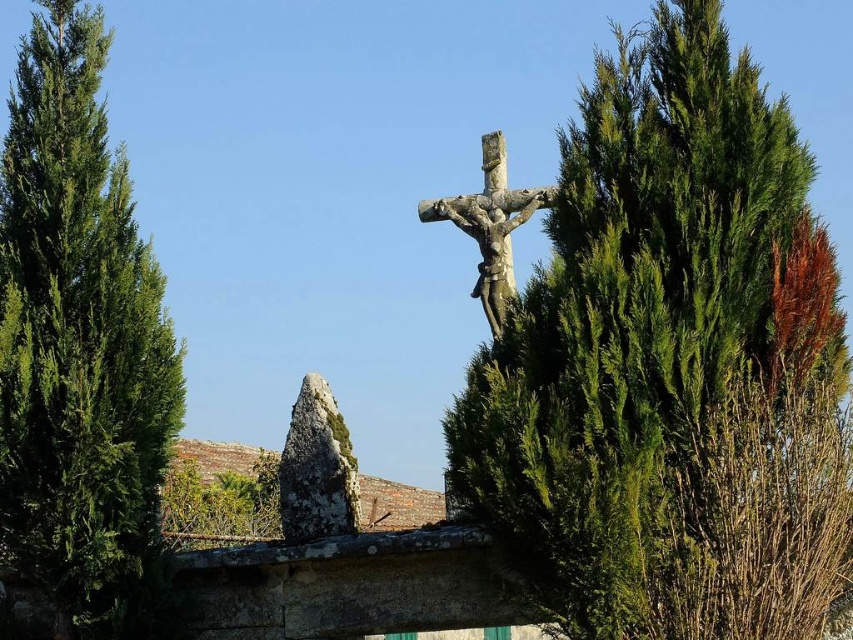
You are a landscape architect designing a garden and want to place the rough gray stone at center and the stone statue at center in a way that maintains visual balance. Given their sizes, which object should be placed farther from the focal point to achieve this balance?

The rough gray stone at center is smaller than the stone statue at center. To achieve visual balance, the smaller rough gray stone at center should be placed closer to the focal point, while the larger stone statue at center should be positioned farther away. This way, the size and distance compensate each other for balance.

You are standing in front of the stone statue at center and want to take a photo of it. There is a green textured tree at upper right in the background. Will the tree block your view of the statue?

The green textured tree at upper right is closer to the viewer than the stone statue at center, so the tree will block the view of the statue in the photo.